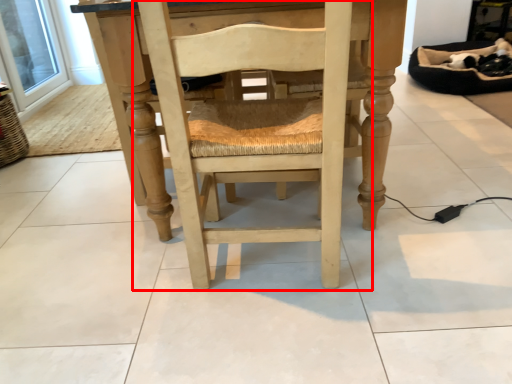
Question: From the image's perspective, what is the correct spatial positioning of chair (annotated by the red box) in reference to window screen?

Choices:
 (A) below
 (B) above

Answer: (A)